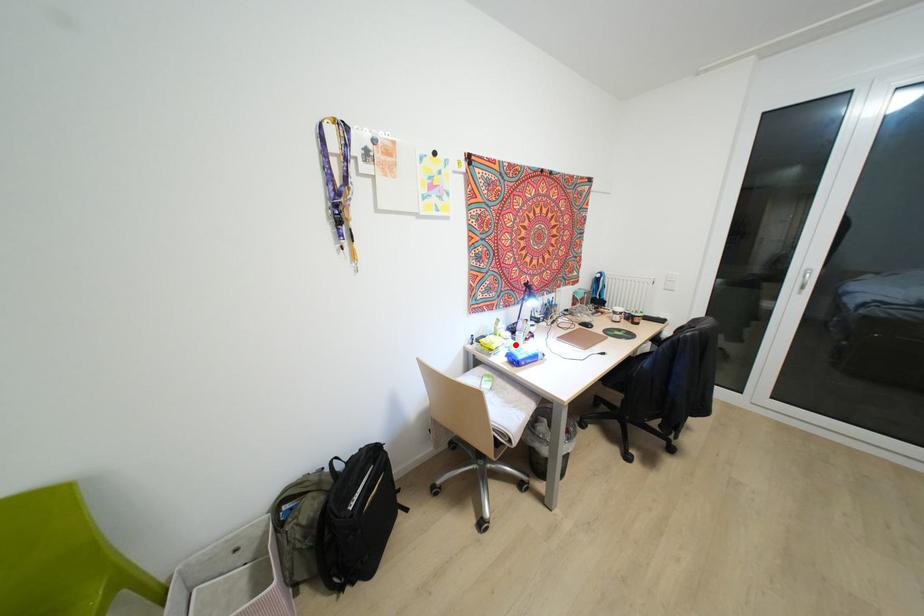
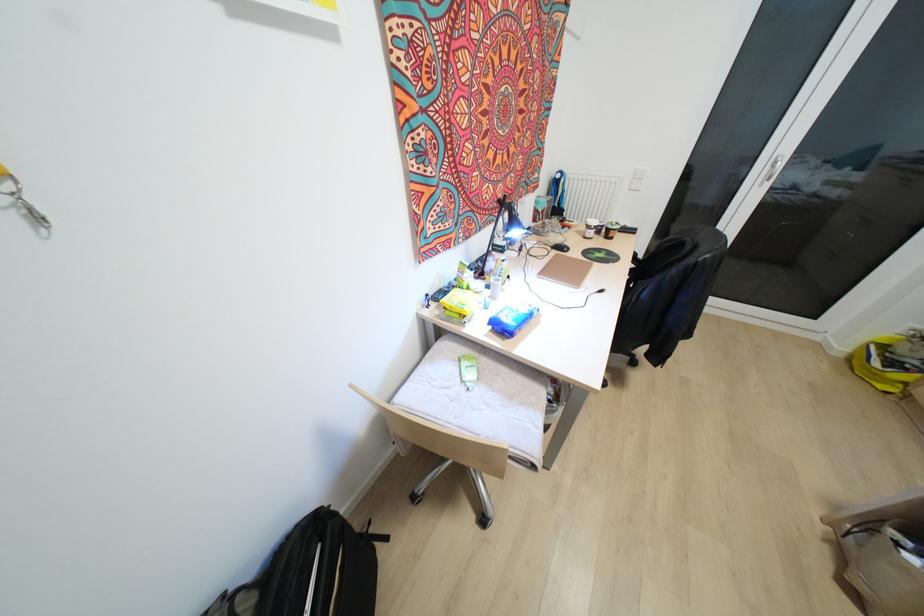
Where in the second image is the point corresponding to the highlighted location from the first image?

(492, 297)